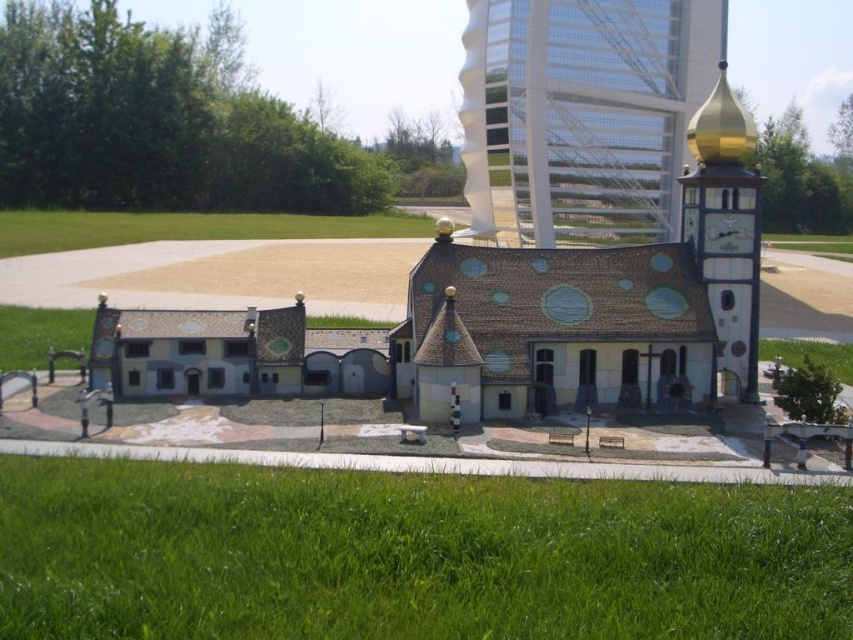
Question: From the image, what is the correct spatial relationship of matte gold dome at upper center in relation to gold metallic clock tower at upper right?

Choices:
 (A) above
 (B) below

Answer: (A)

Question: Which point appears closest to the camera in this image?

Choices:
 (A) (700, 116)
 (B) (589, 147)

Answer: (A)

Question: Which of the following is the farthest from the observer?

Choices:
 (A) (671, 172)
 (B) (701, 132)

Answer: (A)

Question: Is matte gold dome at upper center positioned behind gold metallic clock tower at upper right?

Choices:
 (A) no
 (B) yes

Answer: (B)

Question: Is matte gold dome at upper center to the left of gold metallic clock tower at upper right from the viewer's perspective?

Choices:
 (A) yes
 (B) no

Answer: (A)